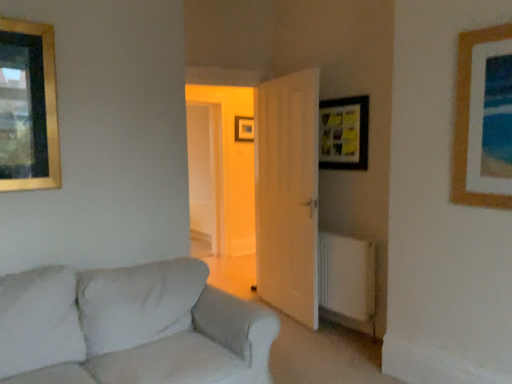
Question: Does point (241, 137) appear closer or farther from the camera than point (25, 76)?

Choices:
 (A) farther
 (B) closer

Answer: (A)

Question: Is wooden picture frame at center, the 1th picture frame when ordered from back to front, inside or outside of gold-framed picture at upper left, which ranks as the 2th picture frame in front-to-back order?

Choices:
 (A) inside
 (B) outside

Answer: (B)

Question: Which object is positioned closest to the wooden picture frame at center, the 4th picture frame in the front-to-back sequence?

Choices:
 (A) wooden picture frame at upper right, the 4th picture frame positioned from the back
 (B) white fabric couch at lower left
 (C) wooden matte picture frame at upper right, the 3th picture frame in the front-to-back sequence
 (D) transparent glass door at center
 (E) white plastic radiator at lower right

Answer: (D)

Question: Considering the real-world distances, which object is farthest from the wooden matte picture frame at upper right, which is counted as the second picture frame, starting from the back?

Choices:
 (A) gold-framed picture at upper left, which is the third picture frame from back to front
 (B) white fabric couch at lower left
 (C) white plastic radiator at lower right
 (D) white wooden door at center
 (E) wooden picture frame at center, arranged as the second picture frame when viewed from the left

Answer: (E)